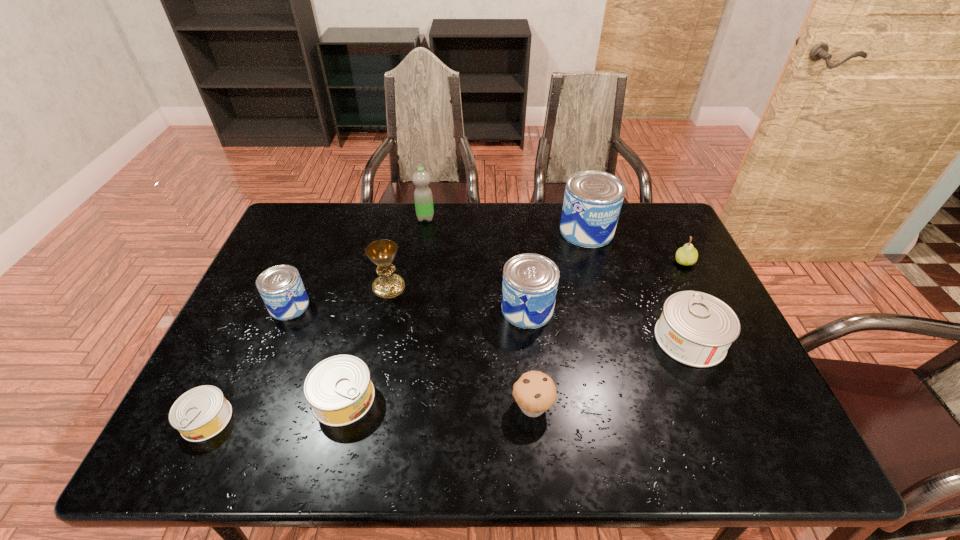
Where is `green water bottle`? green water bottle is located at coordinates (423, 198).

What are the coordinates of `the third object from right to left` in the screenshot? It's located at (593, 199).

I want to click on the tallest can, so click(x=593, y=199).

Identify the location of chalice. Image resolution: width=960 pixels, height=540 pixels. (382, 252).

Identify the location of the second smallest blue can. This screenshot has width=960, height=540. (530, 281).

You are a GUI agent. You are given a task and a screenshot of the screen. Output one action in this format:
    pyautogui.click(x=<x>, y=<y>)
    Task: Click on the second blue can from right to left
    This screenshot has width=960, height=540.
    Given the screenshot: What is the action you would take?
    pyautogui.click(x=530, y=281)

What are the coordinates of `the smallest blue can` in the screenshot? It's located at (281, 288).

This screenshot has width=960, height=540. What are the coordinates of `pear` in the screenshot? It's located at (687, 255).

You are a GUI agent. You are given a task and a screenshot of the screen. Output one action in this format:
    pyautogui.click(x=<x>, y=<y>)
    Task: Click on the green pear
    Image resolution: width=960 pixels, height=540 pixels.
    Given the screenshot: What is the action you would take?
    pyautogui.click(x=687, y=255)

Find the location of a particular element. This screenshot has width=960, height=540. the rightmost silver can is located at coordinates (696, 329).